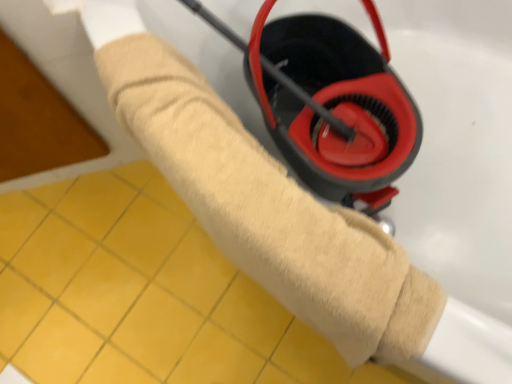
Question: Would you say beige plush towel at center is inside or outside yellow tile at lower left?

Choices:
 (A) outside
 (B) inside

Answer: (A)

Question: Considering the positions of point (159, 130) and point (123, 225), is point (159, 130) closer or farther from the camera than point (123, 225)?

Choices:
 (A) farther
 (B) closer

Answer: (B)

Question: In terms of width, does beige plush towel at center look wider or thinner when compared to yellow tile at lower left?

Choices:
 (A) thin
 (B) wide

Answer: (B)

Question: In the image, is yellow tile at lower left on the left side or the right side of beige plush towel at center?

Choices:
 (A) left
 (B) right

Answer: (A)

Question: Considering the positions of point (179, 253) and point (162, 97), is point (179, 253) closer or farther from the camera than point (162, 97)?

Choices:
 (A) closer
 (B) farther

Answer: (B)

Question: From a real-world perspective, is yellow tile at lower left positioned above or below beige plush towel at center?

Choices:
 (A) above
 (B) below

Answer: (B)

Question: In terms of width, does yellow tile at lower left look wider or thinner when compared to beige plush towel at center?

Choices:
 (A) wide
 (B) thin

Answer: (B)